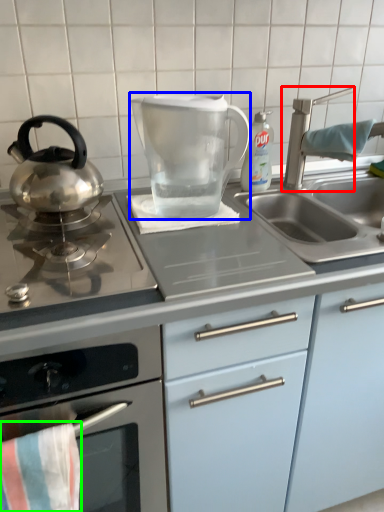
Question: Which object is positioned closest to tap (highlighted by a red box)? Select from kitchen appliance (highlighted by a blue box) and beach towel (highlighted by a green box).

Choices:
 (A) kitchen appliance
 (B) beach towel

Answer: (A)